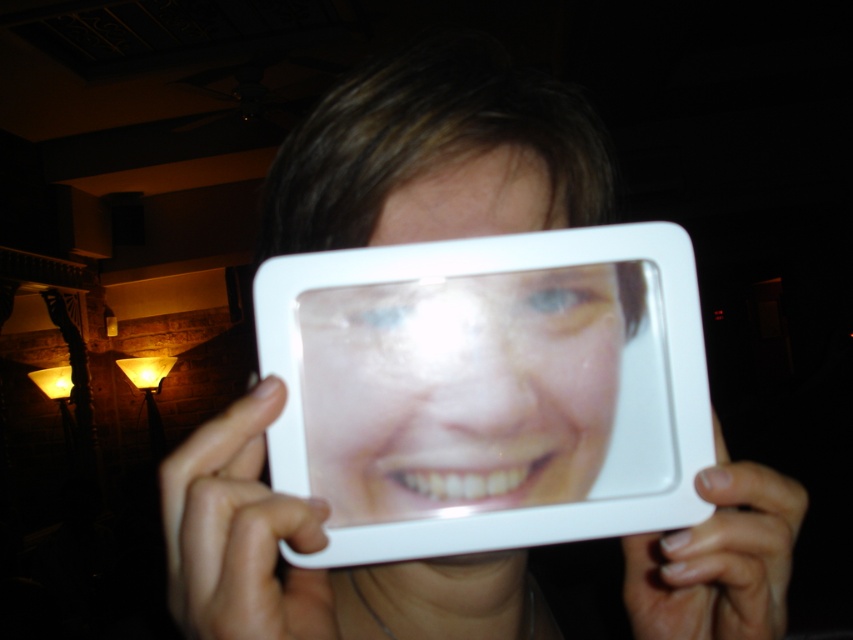
Question: Does matte plastic face at center appear on the right side of white matte plastic at lower right?

Choices:
 (A) no
 (B) yes

Answer: (A)

Question: Can you confirm if white plastic frame at center is positioned to the right of matte plastic face at center?

Choices:
 (A) yes
 (B) no

Answer: (B)

Question: Which object is farther from the camera taking this photo?

Choices:
 (A) white matte phone at center
 (B) white matte plastic at lower right

Answer: (B)

Question: Which point is farther from the camera taking this photo?

Choices:
 (A) (167, 573)
 (B) (432, 186)
 (C) (518, 390)

Answer: (B)

Question: Which object appears farthest from the camera in this image?

Choices:
 (A) matte plastic face at center
 (B) white matte phone at center

Answer: (A)

Question: Does matte plastic face at center appear under white matte plastic at lower right?

Choices:
 (A) yes
 (B) no

Answer: (B)